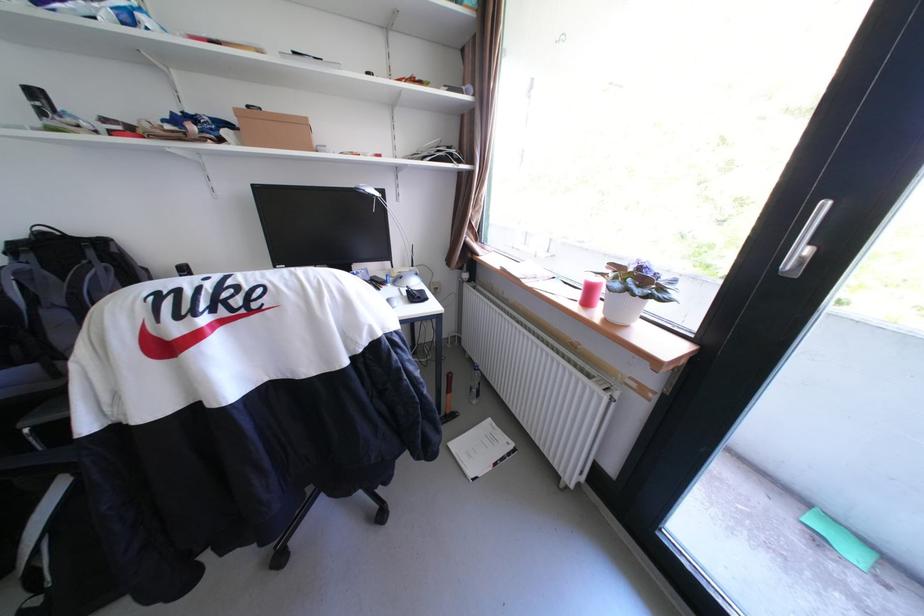
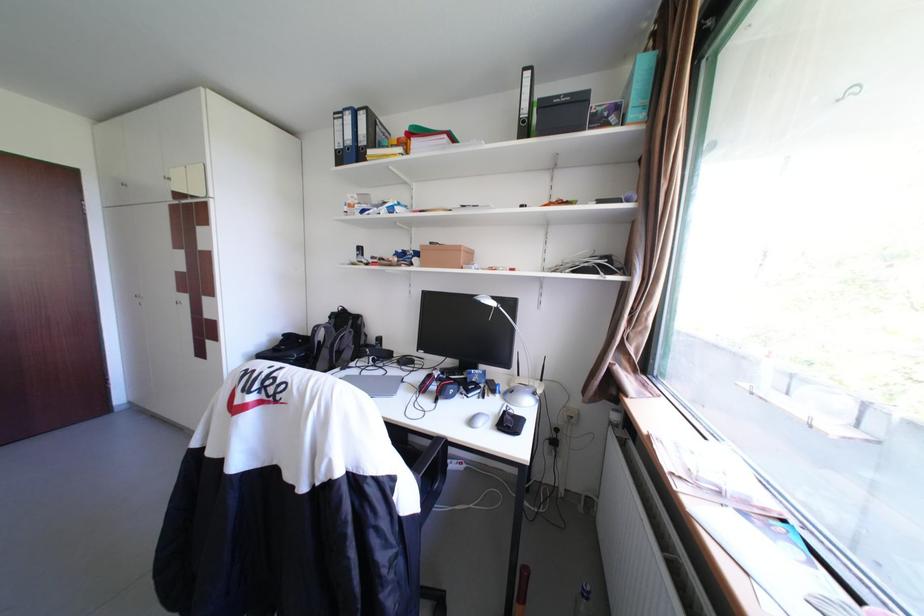
Question: I am providing you with two images of the same scene from different viewpoints. After the viewpoint changes to image2, which objects are now occluded?

Choices:
 (A) white router antenna
 (B) cardboard box
 (C) black storage box
 (D) none of these

Answer: (D)